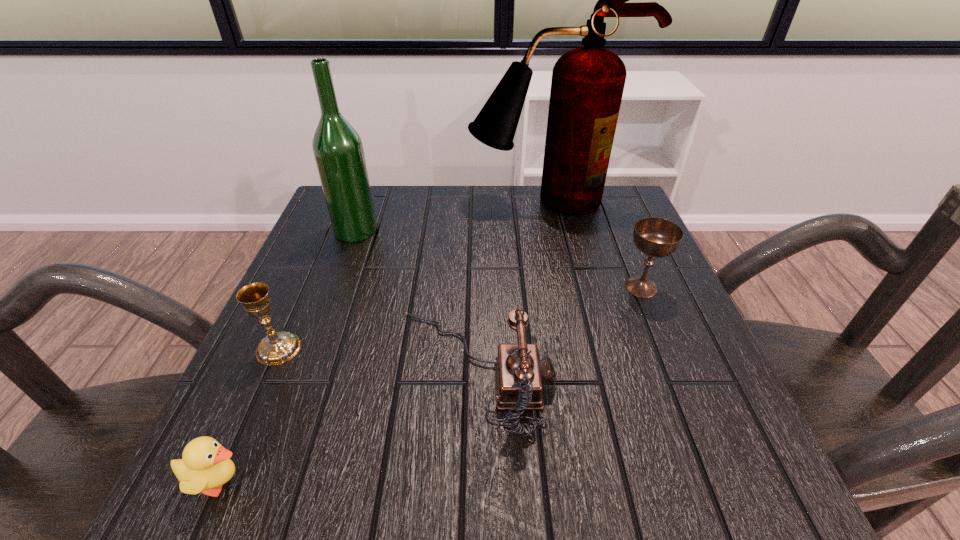
This screenshot has height=540, width=960. I want to click on vacant space located at the nozzle of the farthest object, so click(562, 262).

This screenshot has width=960, height=540. In order to click on free space located on the front of the fifth shortest object in this screenshot , I will do `click(344, 262)`.

Where is `free space located on the left of the farther chalice`? The height and width of the screenshot is (540, 960). free space located on the left of the farther chalice is located at coordinates (586, 287).

Where is `vacant space located 0.180m on the right of the nearer chalice`? The width and height of the screenshot is (960, 540). vacant space located 0.180m on the right of the nearer chalice is located at coordinates (401, 349).

This screenshot has width=960, height=540. In order to click on vacant space situated 0.220m on the dial of the telephone in this screenshot , I will do (684, 371).

I want to click on vacant area located 0.380m on the front-facing side of the nearest object, so click(x=527, y=482).

Locate an element on the screen. fire extinguisher that is at the far edge is located at coordinates (587, 85).

Locate an element on the screen. alcohol that is positioned at the far edge is located at coordinates (338, 151).

You are a GUI agent. You are given a task and a screenshot of the screen. Output one action in this format:
    pyautogui.click(x=<x>, y=<y>)
    Task: Click on the telephone that is at the near edge
    The height and width of the screenshot is (540, 960).
    Given the screenshot: What is the action you would take?
    519,374

The image size is (960, 540). Identify the location of duckling located in the near edge section of the desktop. (205, 466).